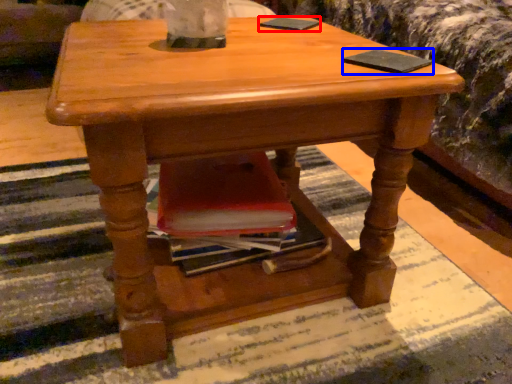
Question: Which object appears farthest to the camera in this image, pad (highlighted by a red box) or pad (highlighted by a blue box)?

Choices:
 (A) pad
 (B) pad

Answer: (A)